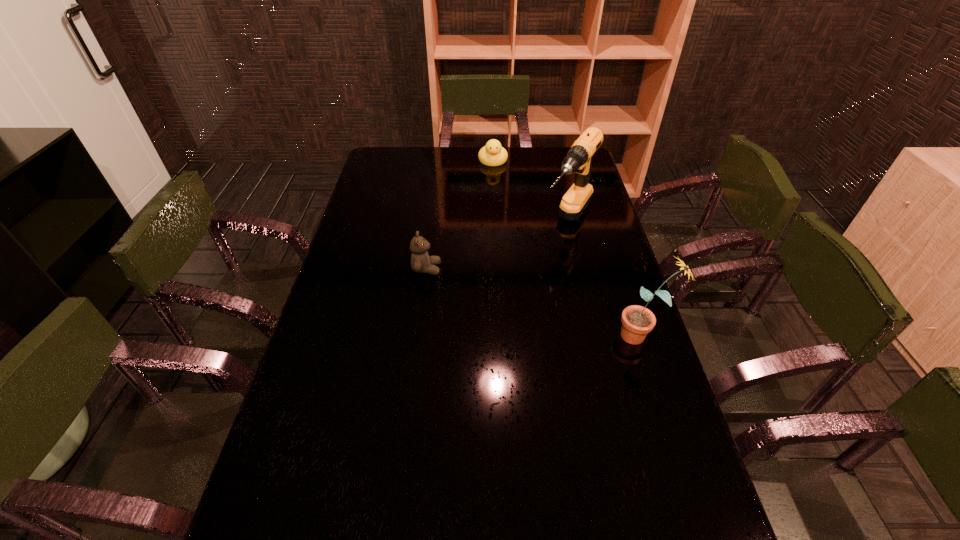
At what (x,y) coordinates should I click in order to perform the action: click on the second nearest object. Please return your answer as a coordinate pair (x, y). Image resolution: width=960 pixels, height=540 pixels. Looking at the image, I should click on (421, 262).

Find the location of a particular element. teddy bear is located at coordinates (421, 262).

You are a GUI agent. You are given a task and a screenshot of the screen. Output one action in this format:
    pyautogui.click(x=<x>, y=<y>)
    Task: Click on the sunflower
    This screenshot has width=960, height=540.
    Given the screenshot: What is the action you would take?
    pyautogui.click(x=637, y=321)

Locate an element on the screen. The width and height of the screenshot is (960, 540). the third nearest object is located at coordinates (579, 158).

Locate an element on the screen. This screenshot has width=960, height=540. the shortest object is located at coordinates (493, 154).

Find the location of a particular element. Image resolution: width=960 pixels, height=540 pixels. the farthest object is located at coordinates (493, 154).

I want to click on vacant space positioned on the face of the second nearest object, so click(x=500, y=269).

You are a GUI agent. You are given a task and a screenshot of the screen. Output one action in this format:
    pyautogui.click(x=<x>, y=<y>)
    Task: Click on the vacant region located on the flower of the nearest object
    
    Given the screenshot: What is the action you would take?
    pyautogui.click(x=505, y=335)

Locate an element on the screen. free region located 0.120m on the flower of the nearest object is located at coordinates (573, 335).

The height and width of the screenshot is (540, 960). In order to click on vacant area situated 0.100m on the flower of the nearest object in this screenshot , I will do `click(581, 335)`.